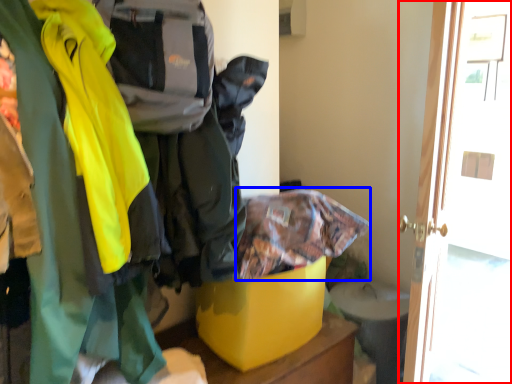
Question: Which of the following is the farthest to the observer, door (highlighted by a red box) or cloak (highlighted by a blue box)?

Choices:
 (A) door
 (B) cloak

Answer: (A)